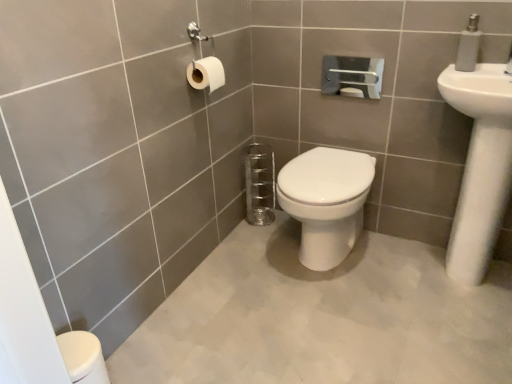
Question: From the image's perspective, is white glossy sink at upper right below white plastic soap dispenser at upper right?

Choices:
 (A) no
 (B) yes

Answer: (B)

Question: Is the position of white glossy sink at upper right more distant than that of white plastic soap dispenser at upper right?

Choices:
 (A) yes
 (B) no

Answer: (B)

Question: Is white glossy sink at upper right oriented towards white plastic soap dispenser at upper right?

Choices:
 (A) no
 (B) yes

Answer: (A)

Question: Can you see white glossy sink at upper right touching white plastic soap dispenser at upper right?

Choices:
 (A) yes
 (B) no

Answer: (B)

Question: Is white glossy sink at upper right to the right of white plastic soap dispenser at upper right from the viewer's perspective?

Choices:
 (A) no
 (B) yes

Answer: (B)

Question: Is white glossy sink at upper right looking in the opposite direction of white plastic soap dispenser at upper right?

Choices:
 (A) no
 (B) yes

Answer: (A)

Question: Is white matte toilet paper at upper left closer to the viewer compared to white glossy sink at upper right?

Choices:
 (A) yes
 (B) no

Answer: (B)

Question: Can you confirm if white matte toilet paper at upper left is shorter than white glossy sink at upper right?

Choices:
 (A) no
 (B) yes

Answer: (B)

Question: Can you confirm if white matte toilet paper at upper left is positioned to the left of white glossy sink at upper right?

Choices:
 (A) no
 (B) yes

Answer: (B)

Question: Is white matte toilet paper at upper left bigger than white glossy sink at upper right?

Choices:
 (A) no
 (B) yes

Answer: (A)

Question: Can you confirm if white matte toilet paper at upper left is thinner than white glossy sink at upper right?

Choices:
 (A) no
 (B) yes

Answer: (B)

Question: From the image's perspective, is white matte toilet paper at upper left above white glossy sink at upper right?

Choices:
 (A) yes
 (B) no

Answer: (A)

Question: From a real-world perspective, is white plastic soap dispenser at upper right located higher than white glossy toilet at center?

Choices:
 (A) yes
 (B) no

Answer: (A)